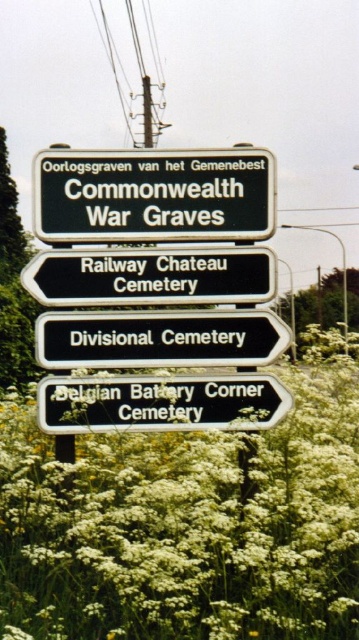
You are a tourist holding a 1.2 meter long walking stick. You want to place it horizontally between the black metal sign at center and the green plastic sign at lower right. Can the walking stick fit between them without bending?

The black metal sign at center is shorter than the green plastic sign at lower right, so the distance between them might be insufficient. However, the exact spatial relationship isn

You are standing in a field and see the white fluffy flowers at center and the green plastic sign at lower right. Which object is located to the left of the other?

The white fluffy flowers at center is positioned on the left side of green plastic sign at lower right.

You are holding a measuring tape and need to determine if the black metal sign at center can fit into a storage box that is exactly the width of the green plastic sign at lower right. Can it fit?

The black metal sign at center might be wider than the green plastic sign at lower right, so it may not fit into the storage box designed for the green plastic sign at lower right.